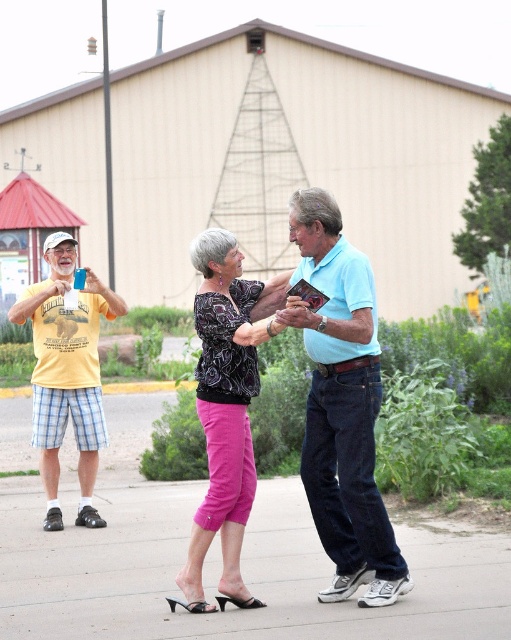
Question: Which point appears farthest from the camera in this image?

Choices:
 (A) (327, 275)
 (B) (56, 604)

Answer: (B)

Question: Can you confirm if light blue cotton shirt at center is positioned above yellow cotton t-shirt at left?

Choices:
 (A) yes
 (B) no

Answer: (A)

Question: Is pink fabric pants at lower center to the left of light blue cotton shirt at center from the viewer's perspective?

Choices:
 (A) no
 (B) yes

Answer: (B)

Question: Is light blue cotton shirt at center positioned behind patterned fabric blouse at center?

Choices:
 (A) no
 (B) yes

Answer: (A)

Question: Based on their relative distances, which object is farther from the light blue cotton shirt at center?

Choices:
 (A) patterned fabric blouse at center
 (B) yellow cotton t-shirt at left
 (C) pink fabric pants at lower center

Answer: (B)

Question: Estimate the real-world distances between objects in this image. Which object is farther from the light blue cotton shirt at center?

Choices:
 (A) pink fabric pants at lower center
 (B) yellow cotton t-shirt at left
 (C) patterned fabric blouse at center

Answer: (B)